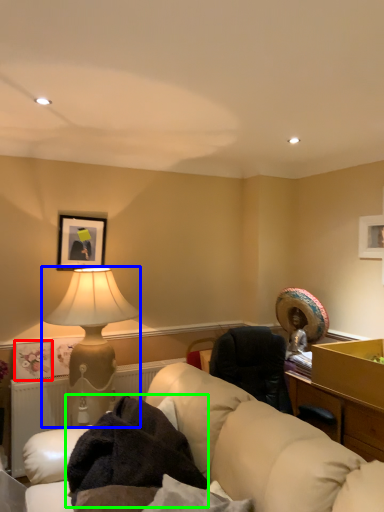
Question: Based on their relative distances, which object is nearer to picture frame (highlighted by a red box)? Choose from lamp (highlighted by a blue box) and blanket (highlighted by a green box).

Choices:
 (A) lamp
 (B) blanket

Answer: (A)